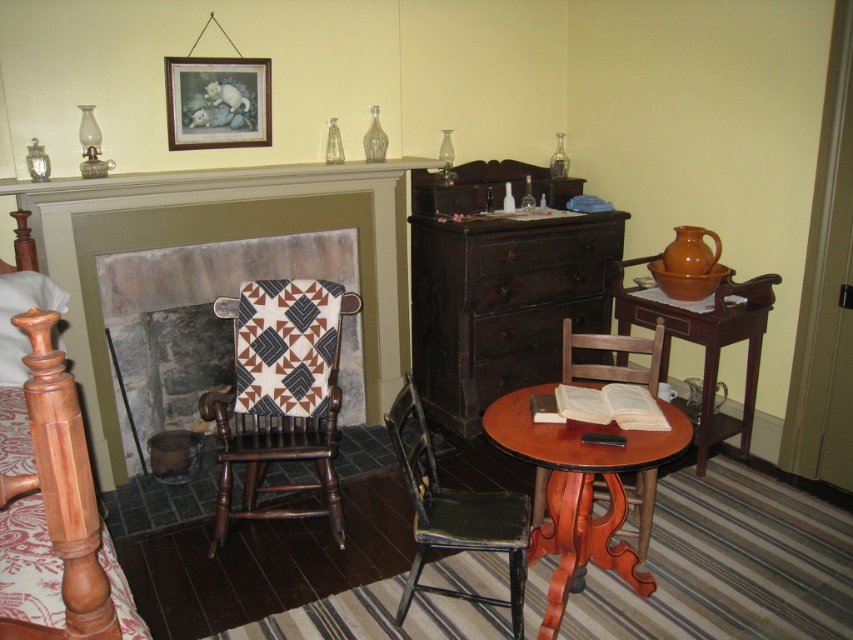
Question: Is the position of wooden bedpost at left more distant than that of mahogany wood round table at lower center?

Choices:
 (A) no
 (B) yes

Answer: (A)

Question: Does mahogany wood round table at lower center have a smaller size compared to brown wood side table at right?

Choices:
 (A) yes
 (B) no

Answer: (A)

Question: Based on their relative distances, which object is nearer to the wooden picture frame at upper center?

Choices:
 (A) wooden bedpost at left
 (B) stone fireplace at center

Answer: (B)

Question: Estimate the real-world distances between objects in this image. Which object is farther from the mahogany wood armchair at center?

Choices:
 (A) mahogany wood round table at lower center
 (B) stone fireplace at center

Answer: (B)

Question: Which of the following is the farthest from the observer?

Choices:
 (A) wooden picture frame at upper center
 (B) mahogany wood round table at lower center
 (C) stone fireplace at center

Answer: (C)

Question: Is distressed green wood chair at lower center closer to the viewer compared to brown wood side table at right?

Choices:
 (A) no
 (B) yes

Answer: (B)